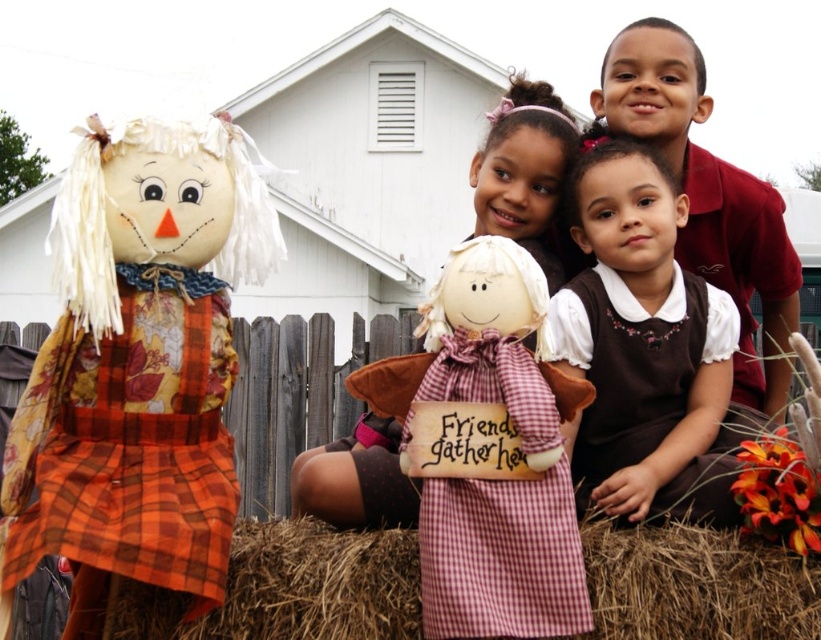
You are a photographer setting up a shot of the matte plaid scarecrow at left and the white fabric doll at center. You want to ensure both subjects are in frame without moving them. Which subject requires a wider angle to capture fully?

The white fabric doll at center requires a wider angle because it has a greater width than the matte plaid scarecrow at left.

You are a photographer trying to take a picture of the brown cotton dress at center and the red checkered fabric doll at center. Which object is blocking the other one in the image?

The brown cotton dress at center is positioned over the red checkered fabric doll at center, so it is blocking the doll in the image.